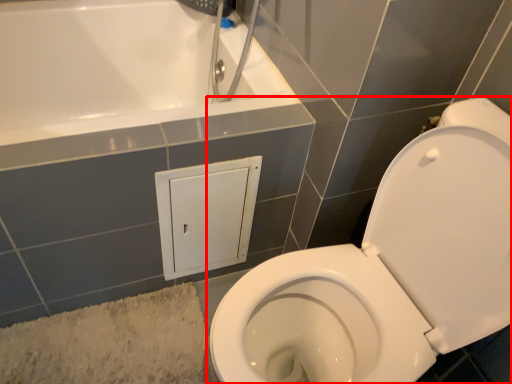
Question: Considering the relative positions of toilet (annotated by the red box) and bath mat in the image provided, where is toilet (annotated by the red box) located with respect to the staircase?

Choices:
 (A) right
 (B) left

Answer: (A)